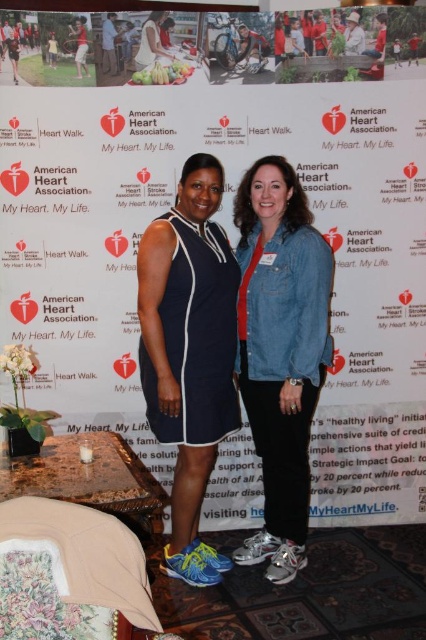
Is denim jacket at center above navy blue jersey dress at center?

Yes, denim jacket at center is above navy blue jersey dress at center.

Who is higher up, denim jacket at center or navy blue jersey dress at center?

denim jacket at center

This screenshot has height=640, width=426. I want to click on denim jacket at center, so (x=281, y=349).

Can you confirm if white paper at center is positioned below denim jacket at center?

Actually, white paper at center is above denim jacket at center.

Is point (230, 234) positioned behind point (267, 259)?

Yes, point (230, 234) is behind point (267, 259).

Find the location of a particular element. white paper at center is located at coordinates coord(233,246).

Between white paper at center and white satin dress at upper center, which one has more height?

white paper at center is taller.

The image size is (426, 640). What do you see at coordinates (233, 246) in the screenshot?
I see `white paper at center` at bounding box center [233, 246].

Find the location of `white paper at center`. white paper at center is located at coordinates (233, 246).